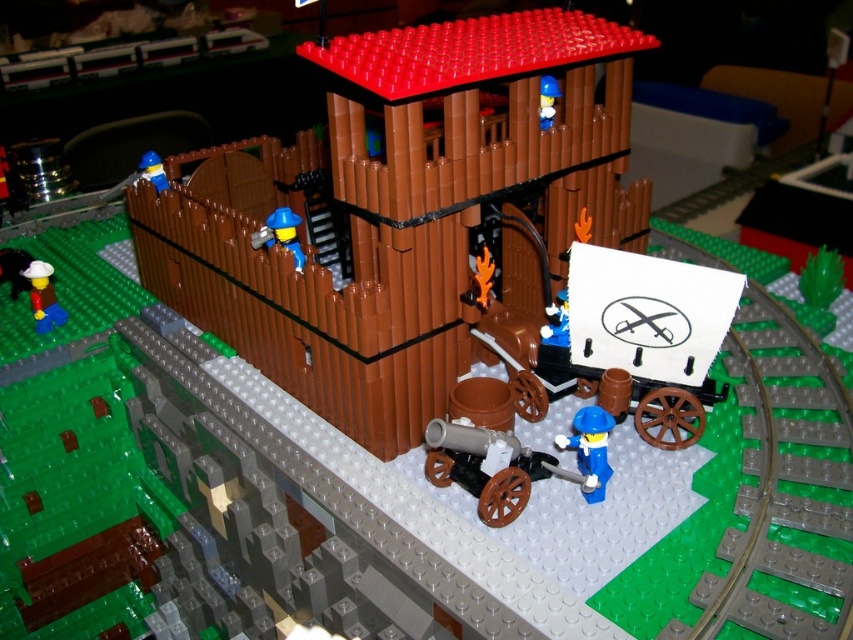
Question: Considering the real-world distances, which object is closest to the brown matte wooden house at center?

Choices:
 (A) blue plastic minifigure at center
 (B) blue plastic minifigure at upper left
 (C) blue plastic minifigure at upper center
 (D) blue plastic figure at lower right

Answer: (A)

Question: Is white matte cowboy hat at lower left closer to camera compared to blue plastic minifigure at upper left?

Choices:
 (A) yes
 (B) no

Answer: (A)

Question: Which point is farther from the camera taking this photo?

Choices:
 (A) (589, 428)
 (B) (158, 188)

Answer: (B)

Question: Can you confirm if blue plastic figure at lower right is wider than blue plastic minifigure at center?

Choices:
 (A) yes
 (B) no

Answer: (B)

Question: Is white matte cowboy hat at lower left bigger than blue plastic minifigure at center?

Choices:
 (A) yes
 (B) no

Answer: (A)

Question: Considering the real-world distances, which object is farthest from the blue plastic minifigure at upper left?

Choices:
 (A) blue plastic figure at lower right
 (B) white matte cowboy hat at lower left
 (C) blue plastic minifigure at upper center

Answer: (A)